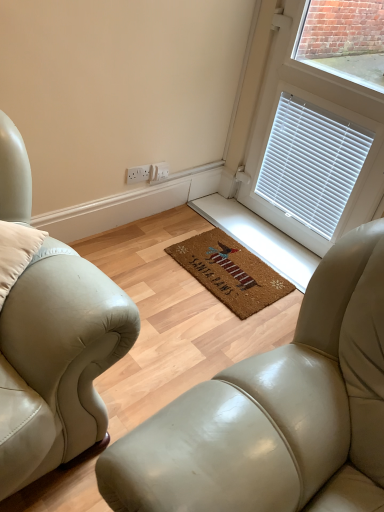
Question: From a real-world perspective, is leather studio couch at center positioned above or below white blinds at upper right?

Choices:
 (A) below
 (B) above

Answer: (A)

Question: Considering the relative positions of leather studio couch at center and white blinds at upper right in the image provided, is leather studio couch at center to the left or to the right of white blinds at upper right?

Choices:
 (A) left
 (B) right

Answer: (A)

Question: Which object is the farthest from the white plastic electrical outlet at center?

Choices:
 (A) white blinds at upper right
 (B) leather studio couch at center
 (C) brown coir mat at center

Answer: (B)

Question: Which object is the closest to the white blinds at upper right?

Choices:
 (A) leather studio couch at center
 (B) white plastic electrical outlet at center
 (C) brown coir mat at center

Answer: (C)